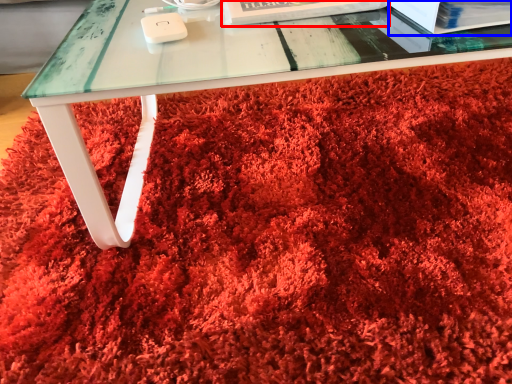
Question: Which object is further to the camera taking this photo, paperback book (highlighted by a red box) or paperback book (highlighted by a blue box)?

Choices:
 (A) paperback book
 (B) paperback book

Answer: (A)